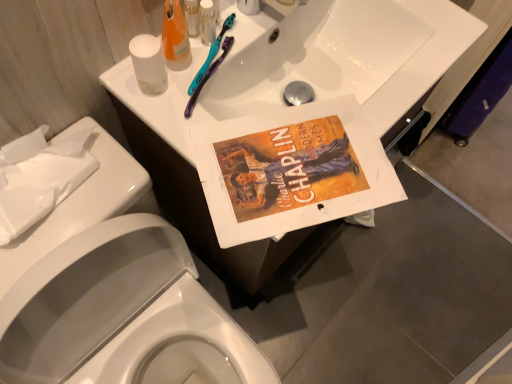
Find the location of `free space in front of translucent orange liquid at upper center`. free space in front of translucent orange liquid at upper center is located at coordinates 192,129.